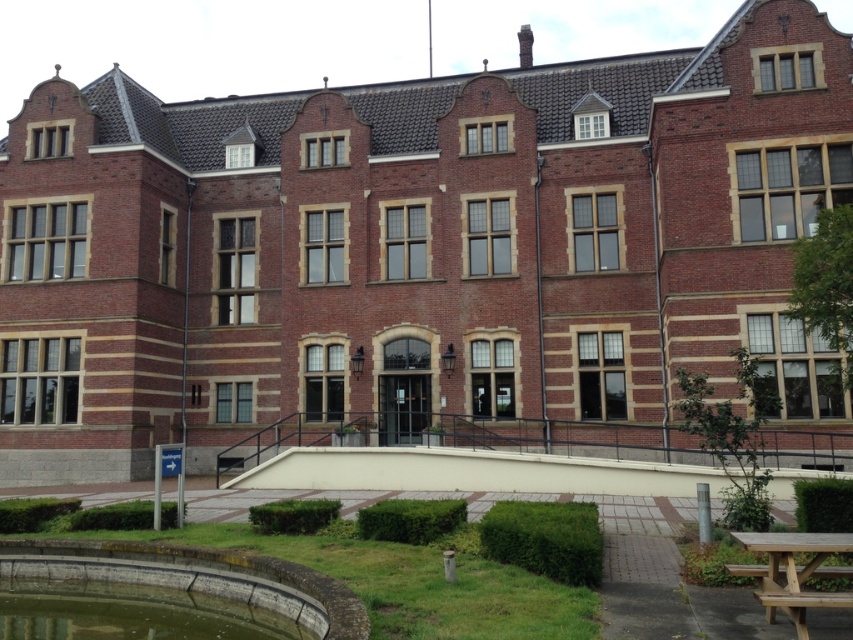
Is green mossy pond at lower left above wooden picnic table at lower right?

Incorrect, green mossy pond at lower left is not positioned above wooden picnic table at lower right.

Between green mossy pond at lower left and wooden picnic table at lower right, which one has more height?

With more height is green mossy pond at lower left.

Between point (38, 634) and point (770, 577), which one is positioned behind?

Point (38, 634)

Where is `green mossy pond at lower left`? green mossy pond at lower left is located at coordinates (129, 612).